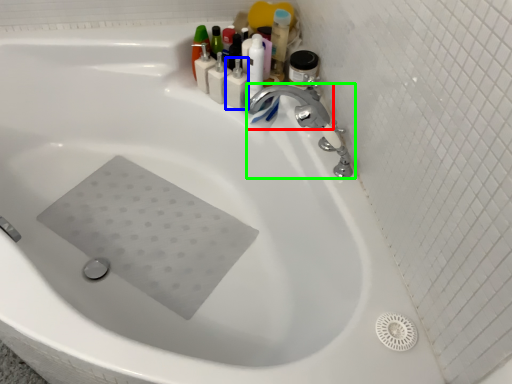
Question: Considering the real-world distances, which object is closest to tap (highlighted by a red box)? toiletry (highlighted by a blue box) or tap (highlighted by a green box).

Choices:
 (A) toiletry
 (B) tap

Answer: (B)